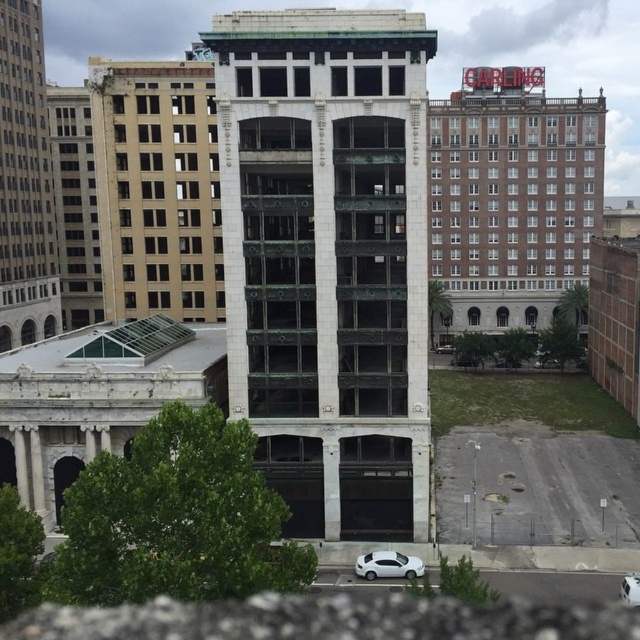
You are a delivery driver approaching the green marble tower at center and the white matte car at lower center. Which object is positioned to the right side of the other?

The white matte car at lower center is positioned to the right of the green marble tower at center.